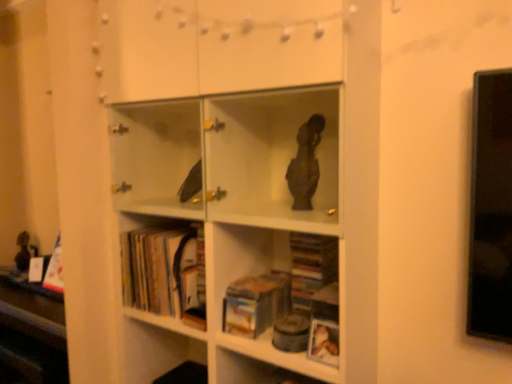
Question: Is white matte bookcase at center smaller than hardcover book at center, positioned as the first book in right-to-left order?

Choices:
 (A) yes
 (B) no

Answer: (B)

Question: Does white matte bookcase at center appear on the left side of hardcover book at center, which ranks as the second book in left-to-right order?

Choices:
 (A) no
 (B) yes

Answer: (B)

Question: Is white matte bookcase at center closer to camera compared to hardcover book at center, which ranks as the second book in left-to-right order?

Choices:
 (A) no
 (B) yes

Answer: (B)

Question: Is hardcover book at center, which ranks as the second book in left-to-right order, inside white matte bookcase at center?

Choices:
 (A) yes
 (B) no

Answer: (A)

Question: Is white matte bookcase at center further to camera compared to hardcover book at center, which ranks as the second book in left-to-right order?

Choices:
 (A) yes
 (B) no

Answer: (B)

Question: Is point (138, 274) positioned closer to the camera than point (262, 306)?

Choices:
 (A) farther
 (B) closer

Answer: (A)

Question: Is white matte bookcase at center wider or thinner than hardcover book at center, positioned as the first book in right-to-left order?

Choices:
 (A) wide
 (B) thin

Answer: (A)

Question: Considering the positions of white matte bookcase at center and hardcover book at center, which ranks as the second book in left-to-right order, in the image, is white matte bookcase at center taller or shorter than hardcover book at center, which ranks as the second book in left-to-right order,?

Choices:
 (A) tall
 (B) short

Answer: (A)

Question: Considering the positions of white matte bookcase at center and hardcover book at center, which ranks as the second book in left-to-right order, in the image, is white matte bookcase at center bigger or smaller than hardcover book at center, which ranks as the second book in left-to-right order,?

Choices:
 (A) big
 (B) small

Answer: (A)

Question: Considering the positions of point (197, 357) and point (176, 311), is point (197, 357) closer or farther from the camera than point (176, 311)?

Choices:
 (A) closer
 (B) farther

Answer: (B)

Question: Is white matte bookcase at center spatially inside hardcover books at lower left, which is the 2th book in right-to-left order, or outside of it?

Choices:
 (A) inside
 (B) outside

Answer: (B)

Question: Is white matte bookcase at center taller or shorter than hardcover books at lower left, which is the 1th book in left-to-right order?

Choices:
 (A) short
 (B) tall

Answer: (B)

Question: Is white matte bookcase at center bigger or smaller than hardcover books at lower left, which is the 2th book in right-to-left order?

Choices:
 (A) small
 (B) big

Answer: (B)

Question: In terms of height, does hardcover books at lower left, which is the 1th book in left-to-right order, look taller or shorter compared to hardcover book at center, which ranks as the second book in left-to-right order?

Choices:
 (A) short
 (B) tall

Answer: (B)

Question: Is point (183, 301) positioned closer to the camera than point (275, 276)?

Choices:
 (A) closer
 (B) farther

Answer: (A)